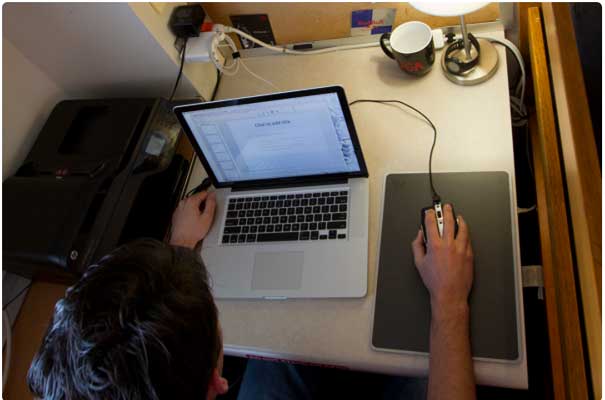
I want to click on black coffee cup, so click(420, 57).